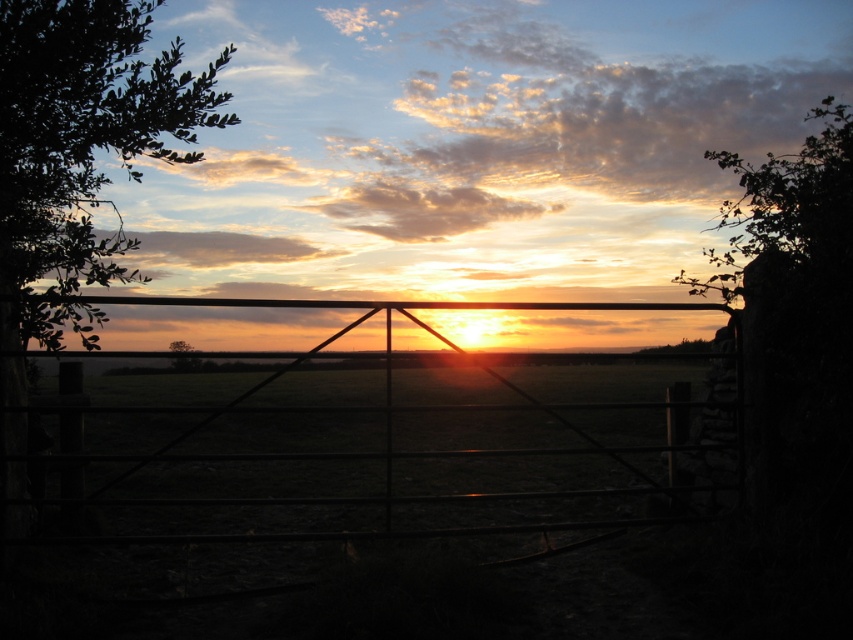
Which is in front, point (233, 412) or point (842, 280)?

Positioned in front is point (842, 280).

Is metallic gate at center closer to the viewer compared to green leafy tree at upper right?

No.

The height and width of the screenshot is (640, 853). I want to click on metallic gate at center, so click(x=397, y=429).

Can you confirm if green leafy tree at upper left is positioned to the left of metallic gate at center?

Indeed, green leafy tree at upper left is positioned on the left side of metallic gate at center.

Locate an element on the screen. The width and height of the screenshot is (853, 640). green leafy tree at upper left is located at coordinates (82, 144).

Is point (68, 237) less distant than point (189, 342)?

No, (68, 237) is behind (189, 342).

In the scene shown: Who is shorter, green leafy tree at upper left or green leafy tree at center?

green leafy tree at center is shorter.

Does point (39, 323) come farther from viewer compared to point (177, 352)?

That is False.

Identify the location of green leafy tree at upper left. (82, 144).